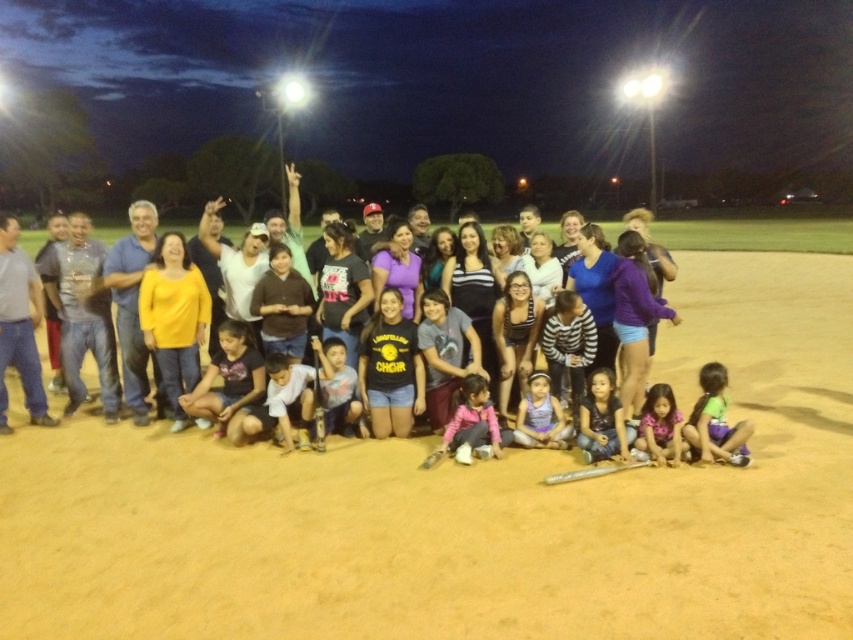
Question: Which of these objects is positioned farthest from the pink fleece jacket at center?

Choices:
 (A) matte blue jeans at lower center
 (B) black matte shirt at center

Answer: (A)

Question: Does purple fabric dress at center appear on the left side of pink floral dress at lower right?

Choices:
 (A) yes
 (B) no

Answer: (A)

Question: Which of the following is the closest to the observer?

Choices:
 (A) purple fabric dress at center
 (B) wooden baseball bat at lower center
 (C) pink fleece jacket at center
 (D) green fabric pants at lower right

Answer: (B)

Question: Which of the following is the farthest from the observer?

Choices:
 (A) purple fabric dress at center
 (B) matte black baseball bats at center
 (C) pink floral dress at lower right

Answer: (A)

Question: Is purple fabric dress at center above pink floral dress at lower right?

Choices:
 (A) no
 (B) yes

Answer: (B)

Question: Where is matte black baseball bats at center located in relation to black matte shirt at center in the image?

Choices:
 (A) right
 (B) left

Answer: (A)